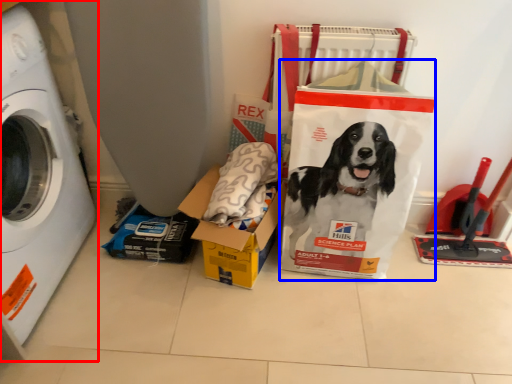
Question: Which point is closer to the camera, washing machine (highlighted by a red box) or paper bag (highlighted by a blue box)?

Choices:
 (A) washing machine
 (B) paper bag

Answer: (A)